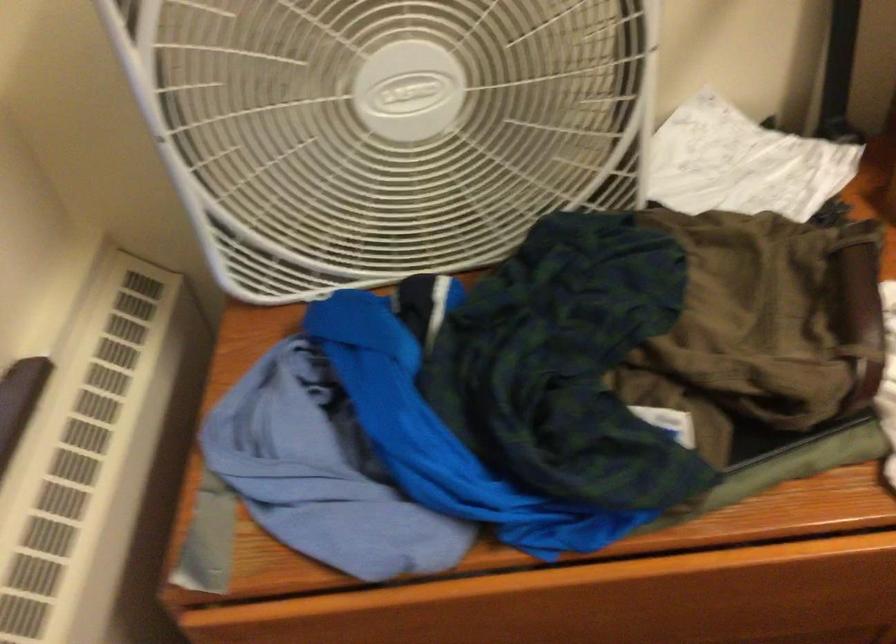
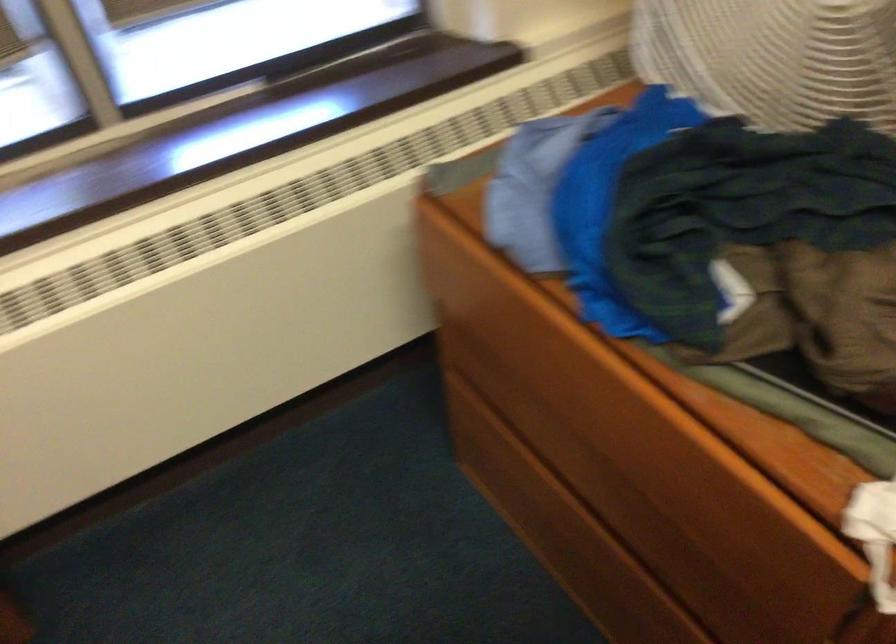
Based on the continuous images, in which direction is the camera rotating?

The camera rotated toward left-down.